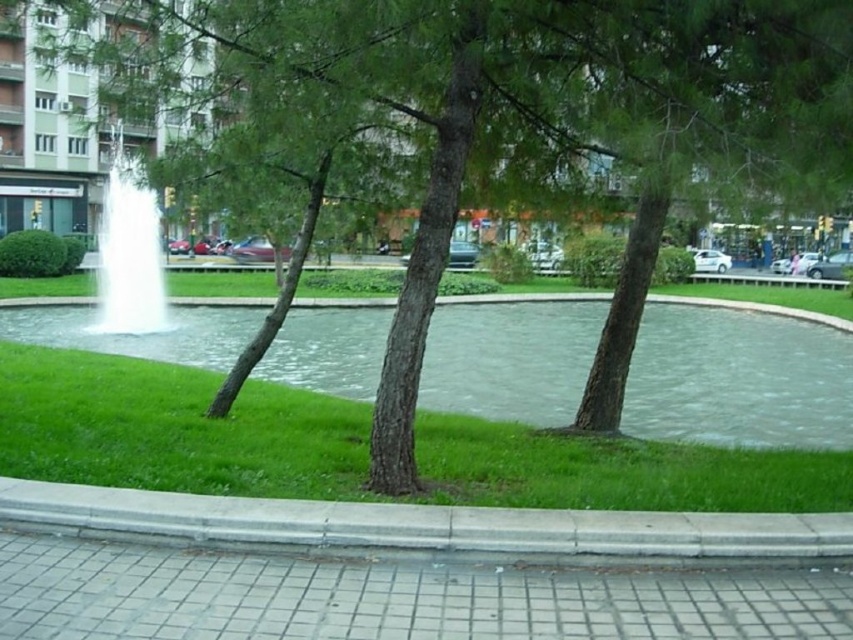
Question: Which object is the closest to the gray concrete sidewalk at lower left?

Choices:
 (A) gray concrete curb at lower center
 (B) white frothy water at center
 (C) green grass at center

Answer: (A)

Question: Which of the following is the farthest from the observer?

Choices:
 (A) white frothy water at center
 (B) gray concrete sidewalk at lower left

Answer: (A)

Question: Can you confirm if gray concrete sidewalk at lower left is wider than gray concrete curb at lower center?

Choices:
 (A) no
 (B) yes

Answer: (A)

Question: Which is nearer to the gray concrete curb at lower center?

Choices:
 (A) gray concrete sidewalk at lower left
 (B) green grass at center

Answer: (A)

Question: Does gray concrete curb at lower center appear over white frothy water at center?

Choices:
 (A) no
 (B) yes

Answer: (A)

Question: Considering the relative positions of gray concrete sidewalk at lower left and white frothy water at center in the image provided, where is gray concrete sidewalk at lower left located with respect to white frothy water at center?

Choices:
 (A) right
 (B) left

Answer: (A)